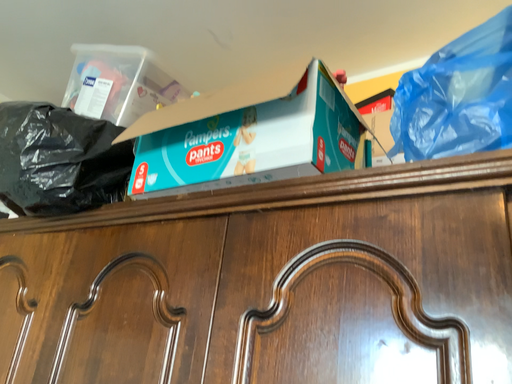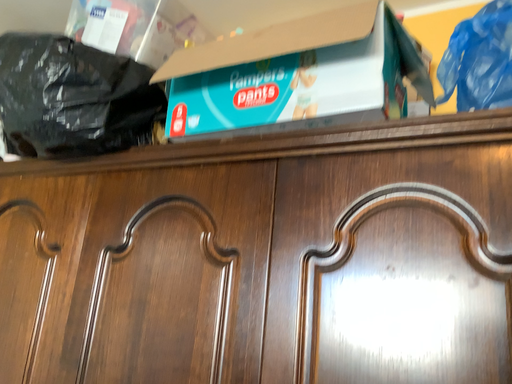
Question: Which way did the camera rotate in the video?

Choices:
 (A) rotated upward
 (B) rotated downward

Answer: (B)